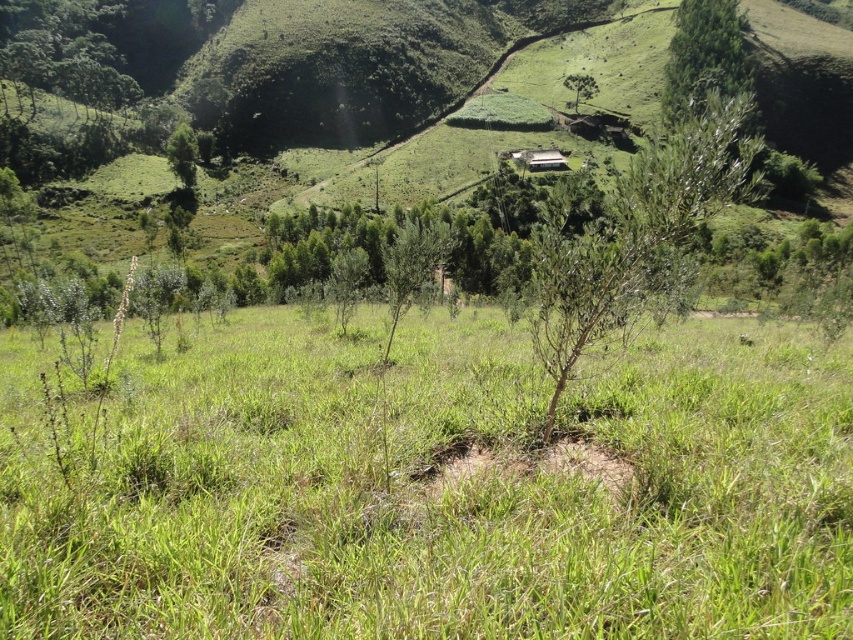
You are standing in the lush landscape and want to take a photo of the green grassy at center and the green leafy tree at center. Which object will appear closer to the camera in the photo?

The green grassy at center will appear closer to the camera because it is positioned in front of the green leafy tree at center.

You are standing in the lush landscape described. There is a point marked at coordinates (430, 484). What type of terrain is located at that point?

The point at (430, 484) corresponds to green grassy terrain, as indicated by the description.

Consider the image. You are standing in the lush green landscape described. You want to walk to a specific point marked at coordinates point (392, 307). How far will you have to walk to reach that point?

The distance of point (392, 307) from viewer is 138.76 feet, so you will have to walk 138.76 feet to reach that point.